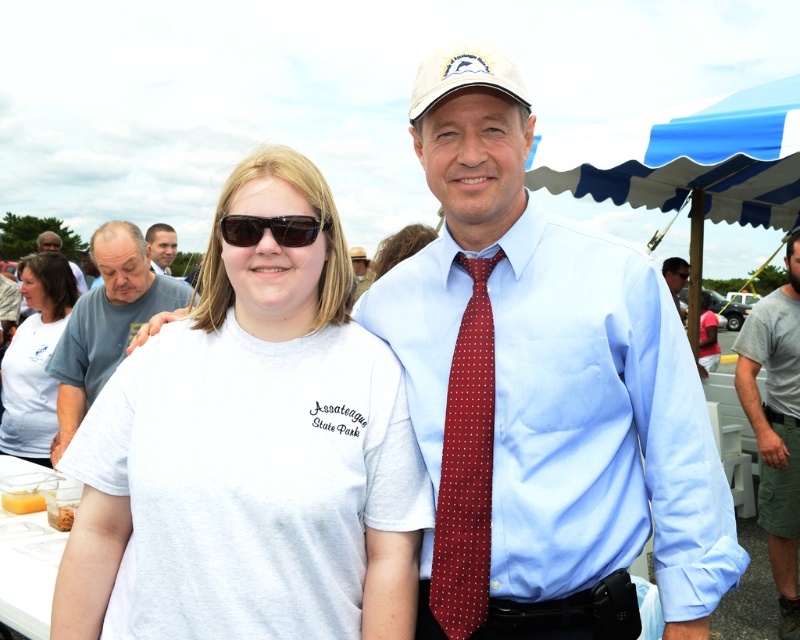
Does gray cotton t-shirt at center come in front of brown matte sunglasses at center?

No, it is not.

Is point (130, 276) behind point (292, 241)?

Yes, it is.

Identify the location of gray cotton t-shirt at center. (106, 323).

Is white cotton t-shirt at left further to camera compared to gray cotton t-shirt at right?

No, white cotton t-shirt at left is closer to the viewer.

The width and height of the screenshot is (800, 640). Find the location of `white cotton t-shirt at left`. white cotton t-shirt at left is located at coordinates (34, 358).

Locate an element on the screen. This screenshot has width=800, height=640. white cotton t-shirt at left is located at coordinates (34, 358).

Who is lower down, brown matte sunglasses at center or matte gray shirt at center?

brown matte sunglasses at center is lower down.

Between point (298, 218) and point (42, 244), which one is positioned behind?

The point (42, 244) is behind.

You are a GUI agent. You are given a task and a screenshot of the screen. Output one action in this format:
    pyautogui.click(x=<x>, y=<y>)
    Task: Click on the brown matte sunglasses at center
    The width and height of the screenshot is (800, 640).
    Given the screenshot: What is the action you would take?
    pyautogui.click(x=270, y=228)